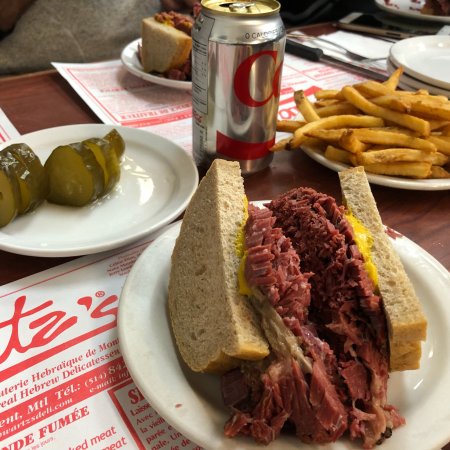
You are a GUI agent. You are given a task and a screenshot of the screen. Output one action in this format:
    pyautogui.click(x=<x>, y=<y>)
    Task: Click on the wood table
    
    Given the screenshot: What is the action you would take?
    pyautogui.click(x=438, y=219)